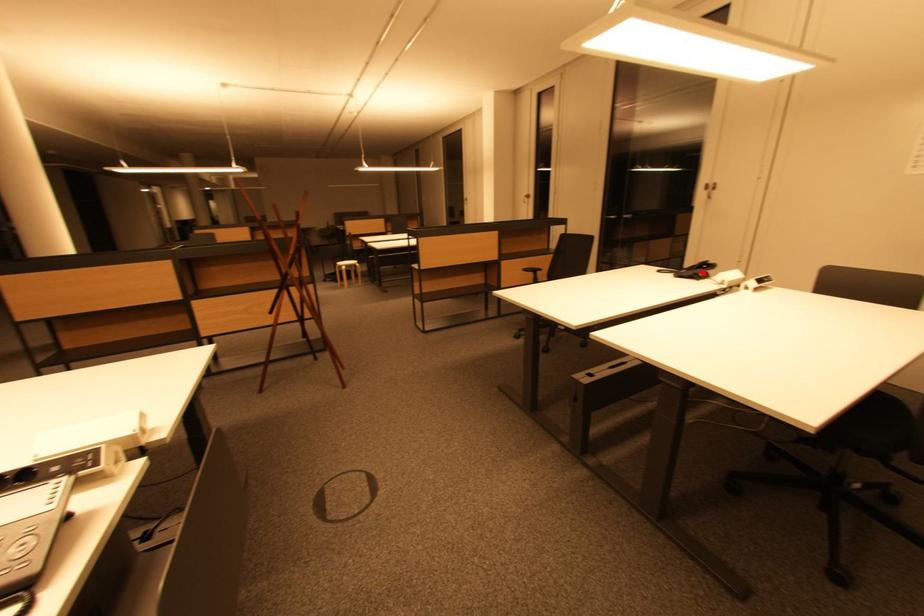
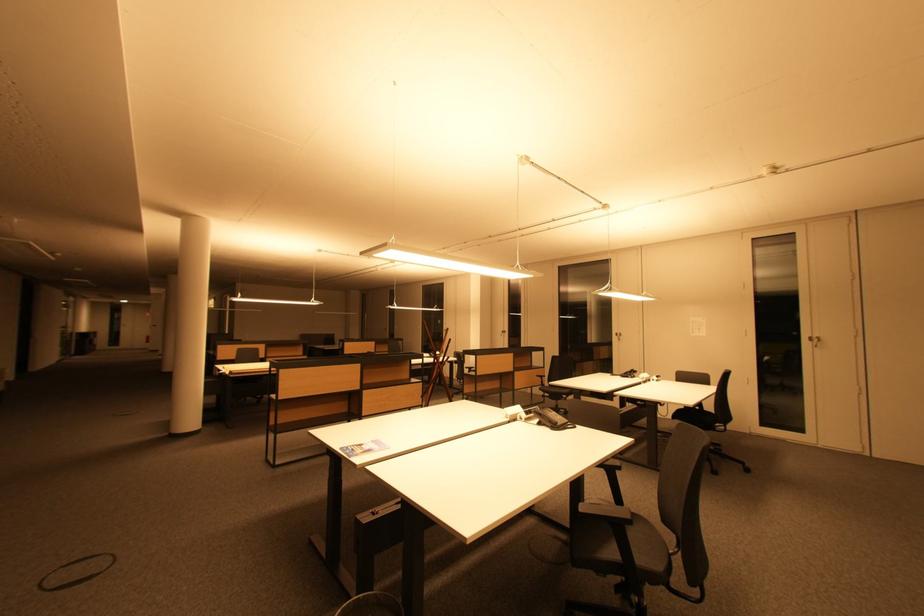
In the second image, find the point that corresponds to the highlighted location in the first image.

(635, 376)